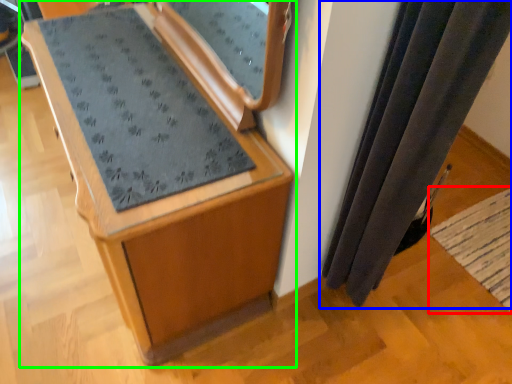
Question: Considering the real-world distances, which object is closest to mat (highlighted by a red box)? curtain (highlighted by a blue box) or furniture (highlighted by a green box).

Choices:
 (A) curtain
 (B) furniture

Answer: (A)